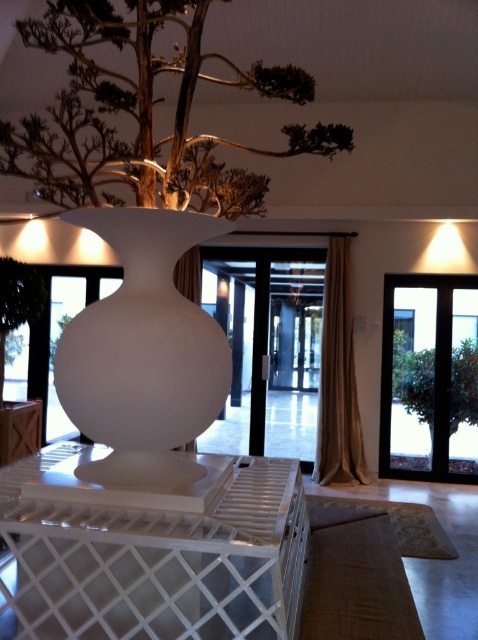
You are a plant delivery person who needs to place a wooden textured bonsai tree at upper center near the entrance of the room. The entrance is near the black glass door at right. Can the bonsai tree fit through the doorway without bending or damaging it?

The wooden textured bonsai tree at upper center is shorter than the black glass door at right, so it can fit through the doorway without any issues as its height is less than the door.

You are an interior designer assessing the space. You need to determine if the white matte vase at center can be placed under the black glass door at right without touching it. Can it fit vertically?

The white matte vase at center is not as tall as the black glass door at right, so it can be placed under the door without touching it vertically.